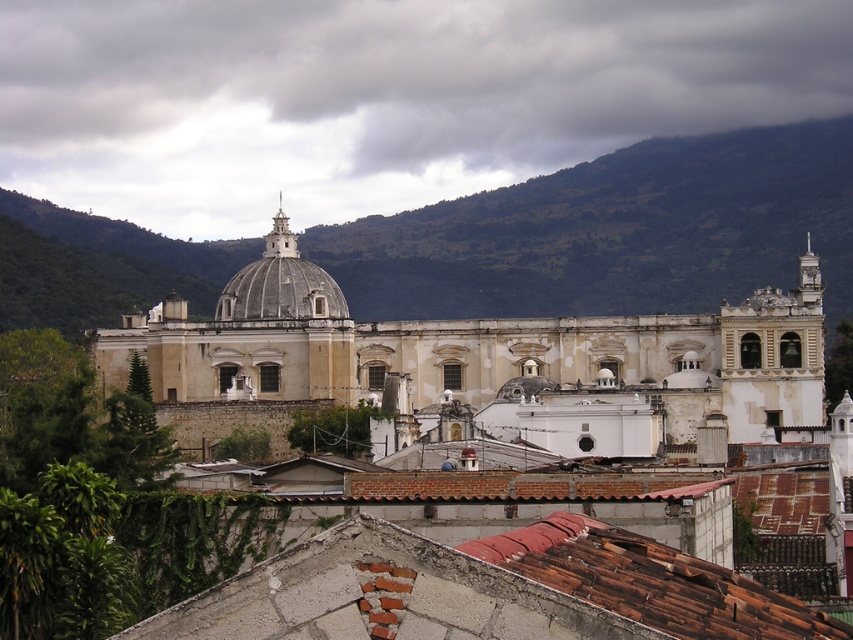
Which is more to the left, brown tile roof at center or smooth gray dome at center?

Positioned to the left is smooth gray dome at center.

Find the location of a particular element. Image resolution: width=853 pixels, height=640 pixels. brown tile roof at center is located at coordinates (486, 589).

Between point (670, 598) and point (289, 262), which one is positioned in front?

Point (670, 598) is more forward.

Locate an element on the screen. Image resolution: width=853 pixels, height=640 pixels. brown tile roof at center is located at coordinates (486, 589).

Does white stone church at center appear over brown tile roof at center?

Yes, white stone church at center is above brown tile roof at center.

Locate an element on the screen. The height and width of the screenshot is (640, 853). white stone church at center is located at coordinates (479, 349).

Where is `white stone church at center`? The width and height of the screenshot is (853, 640). white stone church at center is located at coordinates (479, 349).

Does point (90, 266) lie behind point (671, 436)?

That is True.

You are a GUI agent. You are given a task and a screenshot of the screen. Output one action in this format:
    pyautogui.click(x=<x>, y=<y>)
    Task: Click on the green leafy mountain at upper center
    
    Given the screenshot: What is the action you would take?
    pyautogui.click(x=613, y=232)

Is point (57, 243) positioned in front of point (154, 326)?

No.

This screenshot has width=853, height=640. What are the coordinates of `green leafy mountain at upper center` in the screenshot? It's located at (613, 232).